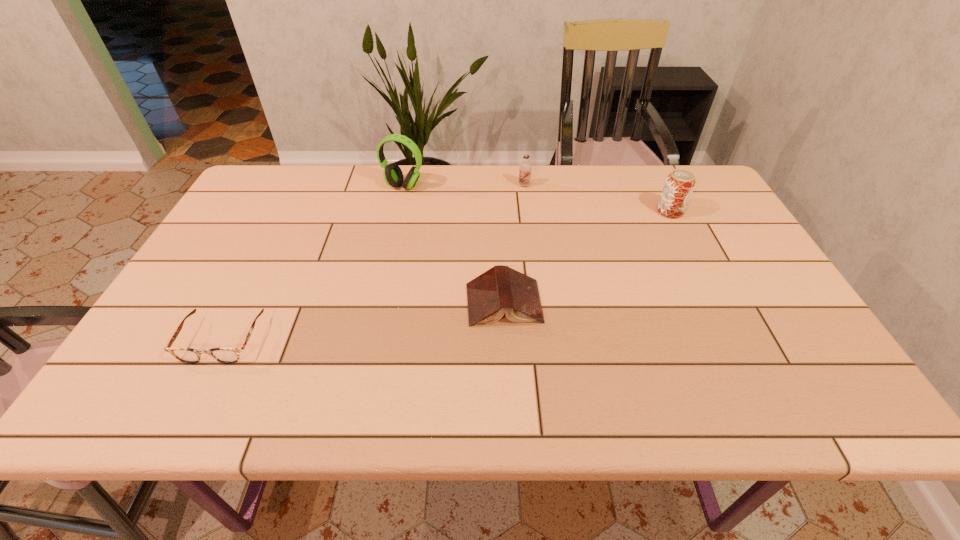
Find the location of a particular element. Image resolution: width=960 pixels, height=540 pixels. the tallest object is located at coordinates (392, 173).

The width and height of the screenshot is (960, 540). Identify the location of headset. (392, 173).

Locate an element on the screen. The width and height of the screenshot is (960, 540). the third farthest object is located at coordinates (679, 185).

Locate an element on the screen. Image resolution: width=960 pixels, height=540 pixels. beer can is located at coordinates (679, 185).

Find the location of `chocolate milk`. chocolate milk is located at coordinates pos(525,168).

The height and width of the screenshot is (540, 960). What are the coordinates of `book` in the screenshot? It's located at (501, 289).

The image size is (960, 540). I want to click on the leftmost object, so click(x=188, y=355).

Identify the location of the shortest object. This screenshot has width=960, height=540. (188, 355).

At what (x,y) coordinates should I click in order to perform the action: click on free space located on the left of the tallest object. Please return your answer as a coordinate pair (x, y). This screenshot has width=960, height=540. Looking at the image, I should click on (344, 186).

Identify the location of blank area located 0.100m on the back of the rightmost object. The width and height of the screenshot is (960, 540). (657, 185).